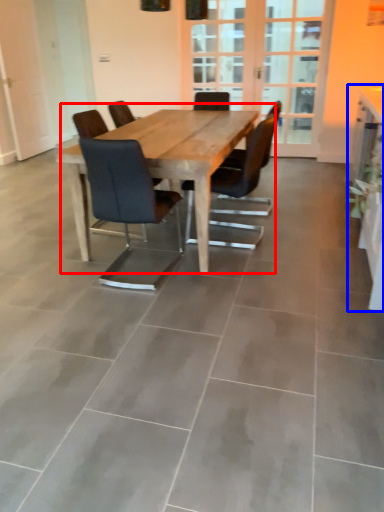
Question: Which object appears closest to the camera in this image, kitchen & dining room table (highlighted by a red box) or computer desk (highlighted by a blue box)?

Choices:
 (A) kitchen & dining room table
 (B) computer desk

Answer: (B)